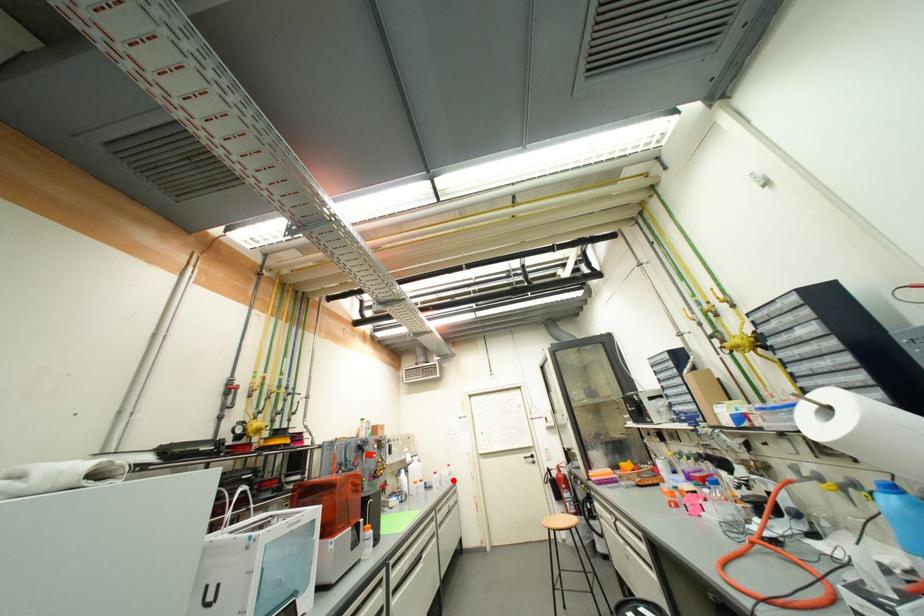
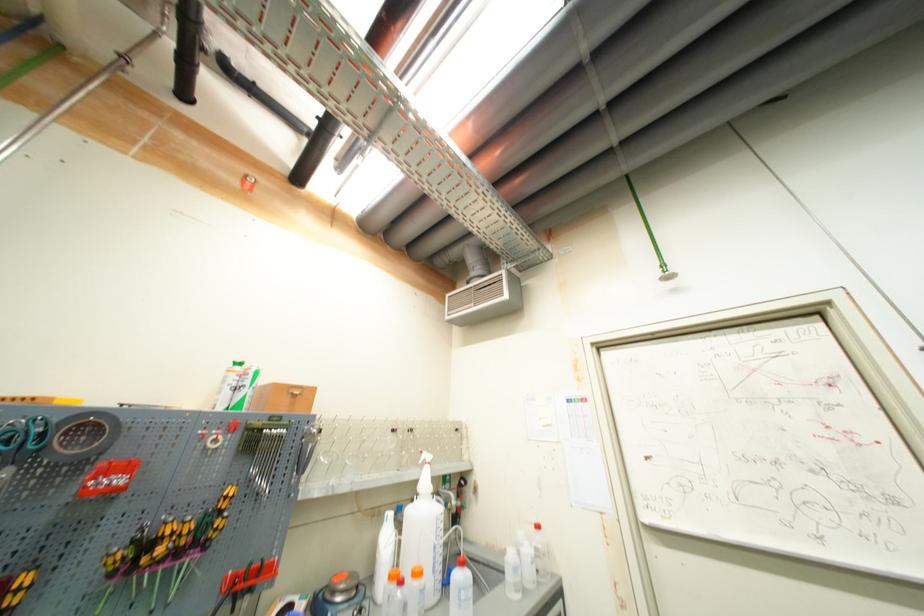
In the second image, find the point that corresponds to the highlighted location in the first image.

(533, 578)